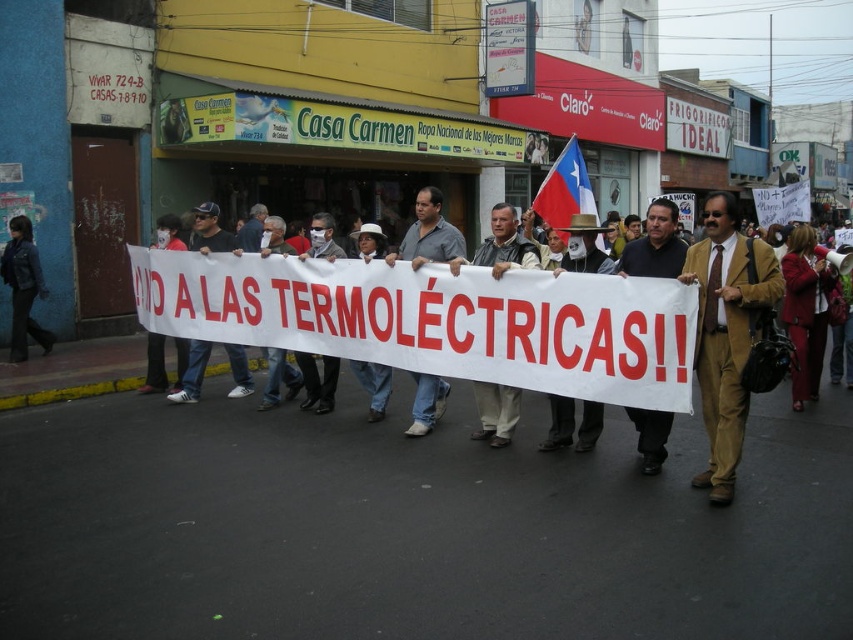
You are a photographer standing at the origin point. You need to capture a photo of the dark brown suit at center. Which direction should you move to get a better shot?

The dark brown suit at center is located at point 0.383 on the x axis and 0.769 on the y axis. Since the photographer is at the origin point, they should move towards the northeast direction to align with the dark brown suit at center.

You are a photographer standing at the edge of the protest. You want to take a photo that includes both the dark brown suit at center and the dark blue jeans at center. What is the minimum distance you need to move backward to ensure both are in frame?

The distance between the dark brown suit at center and dark blue jeans at center is 4.90 meters. To capture both in the frame, you need to move back at least 4.90 meters to ensure the entire span between them fits within your camera view.

You are a photographer standing at the center of the protest scene. You want to take a photo that includes both the protesters holding the banner and the dark blue leather jacket at left. Based on their positions, where should you position yourself to capture both subjects in the frame?

To include both the protesters holding the banner and the dark blue leather jacket at left in the frame, position yourself centrally, as the jacket is located at the left edge of the scene near point (22,289). This central position allows the banner and jacket to be within the camera view.